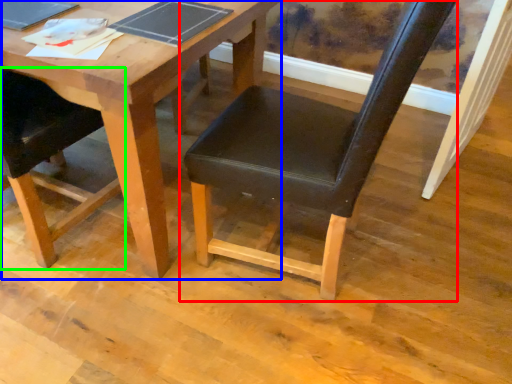
Question: Estimate the real-world distances between objects in this image. Which object is farther from chair (highlighted by a red box), table (highlighted by a blue box) or chair (highlighted by a green box)?

Choices:
 (A) table
 (B) chair

Answer: (B)